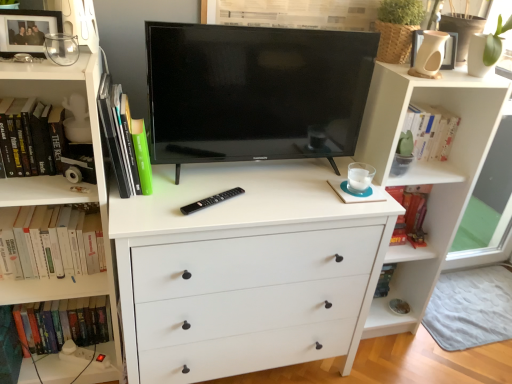
The height and width of the screenshot is (384, 512). What are the coordinates of `free space to the back side of green matte book at left, the 3th book positioned from the bottom` in the screenshot? It's located at (172, 168).